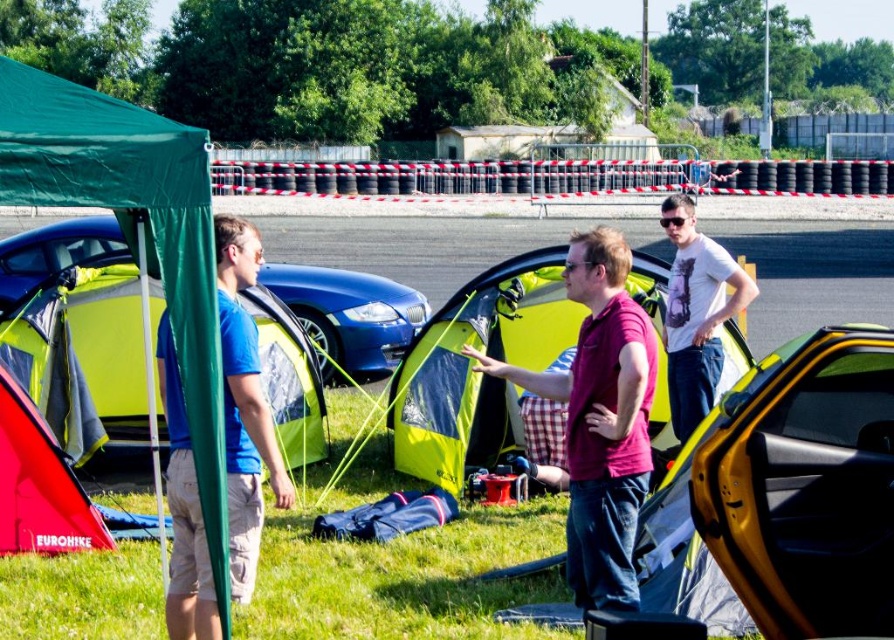
Question: Considering the relative positions of white printed t-shirt at upper right and red fabric tent at lower left in the image provided, where is white printed t-shirt at upper right located with respect to red fabric tent at lower left?

Choices:
 (A) right
 (B) left

Answer: (A)

Question: Which is farther from the glossy blue car at center?

Choices:
 (A) red fabric tent at lower left
 (B) green fabric canopy at left

Answer: (B)

Question: Is yellow metallic car door at right below white printed t-shirt at upper right?

Choices:
 (A) no
 (B) yes

Answer: (B)

Question: Considering the real-world distances, which object is closest to the shiny blue car at center?

Choices:
 (A) matte pink shirt at center
 (B) green fabric canopy at left
 (C) asphalt at center

Answer: (B)

Question: Is white printed t-shirt at upper right below red fabric tent at lower left?

Choices:
 (A) no
 (B) yes

Answer: (A)

Question: Among these points, which one is farthest from the camera?

Choices:
 (A) (207, 344)
 (B) (342, 288)

Answer: (B)